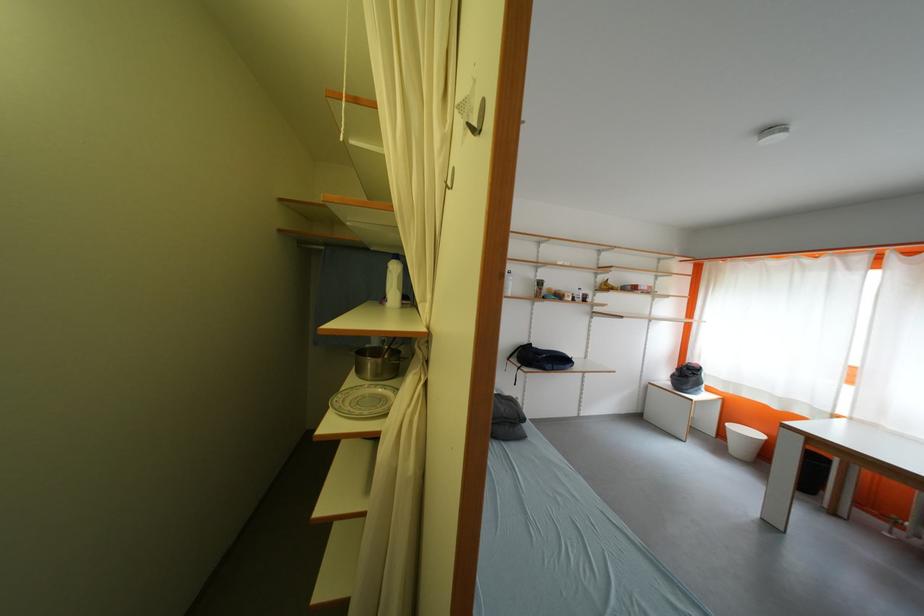
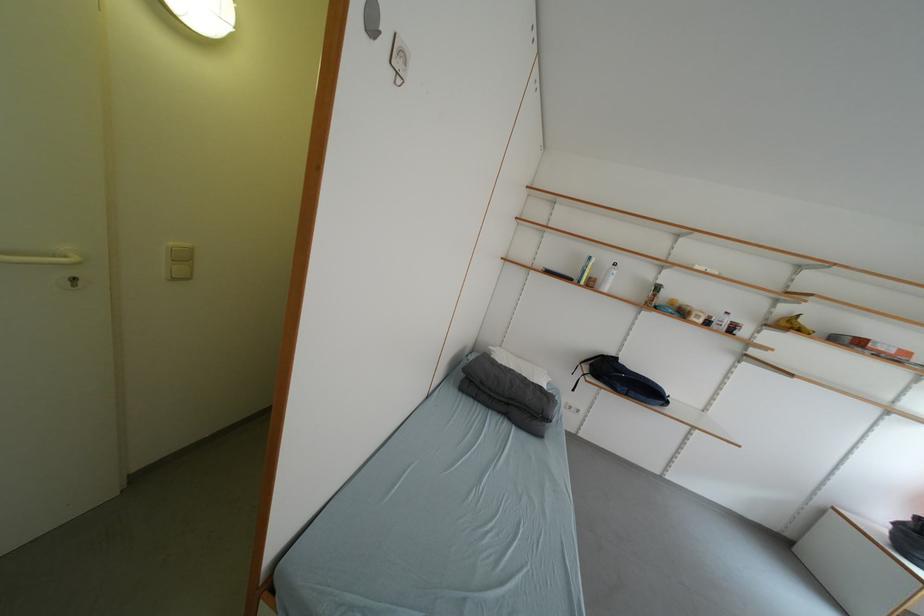
Question: The first image is from the beginning of the video and the second image is from the end. How did the camera likely rotate when shooting the video?

Choices:
 (A) Left
 (B) Right
 (C) Up
 (D) Down

Answer: (A)